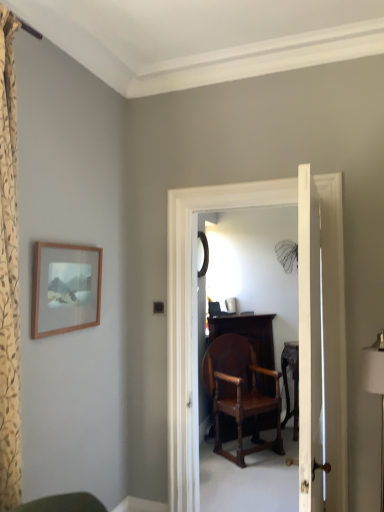
Question: From a real-world perspective, is white fabric lampshade at right on top of white wooden door at center?

Choices:
 (A) yes
 (B) no

Answer: (B)

Question: Does white fabric lampshade at right lie behind white wooden door at center?

Choices:
 (A) no
 (B) yes

Answer: (B)

Question: Does white fabric lampshade at right have a greater height compared to white wooden door at center?

Choices:
 (A) yes
 (B) no

Answer: (B)

Question: Would you say white fabric lampshade at right is a long distance from white wooden door at center?

Choices:
 (A) no
 (B) yes

Answer: (A)

Question: Is white fabric lampshade at right in front of white wooden door at center?

Choices:
 (A) yes
 (B) no

Answer: (B)

Question: Can you confirm if white fabric lampshade at right is thinner than white wooden door at center?

Choices:
 (A) yes
 (B) no

Answer: (B)

Question: Is white wooden door at center closer to the viewer compared to wooden picture frame at upper left?

Choices:
 (A) no
 (B) yes

Answer: (B)

Question: Is white wooden door at center not near wooden picture frame at upper left?

Choices:
 (A) yes
 (B) no

Answer: (A)

Question: From a real-world perspective, is white wooden door at center physically above wooden picture frame at upper left?

Choices:
 (A) yes
 (B) no

Answer: (B)

Question: Is white wooden door at center not inside wooden picture frame at upper left?

Choices:
 (A) yes
 (B) no

Answer: (A)

Question: Is white wooden door at center next to wooden picture frame at upper left and touching it?

Choices:
 (A) no
 (B) yes

Answer: (A)

Question: From the image's perspective, does white wooden door at center appear higher than wooden picture frame at upper left?

Choices:
 (A) yes
 (B) no

Answer: (B)

Question: From a real-world perspective, is wooden carved table at center physically below white fabric lampshade at right?

Choices:
 (A) no
 (B) yes

Answer: (B)